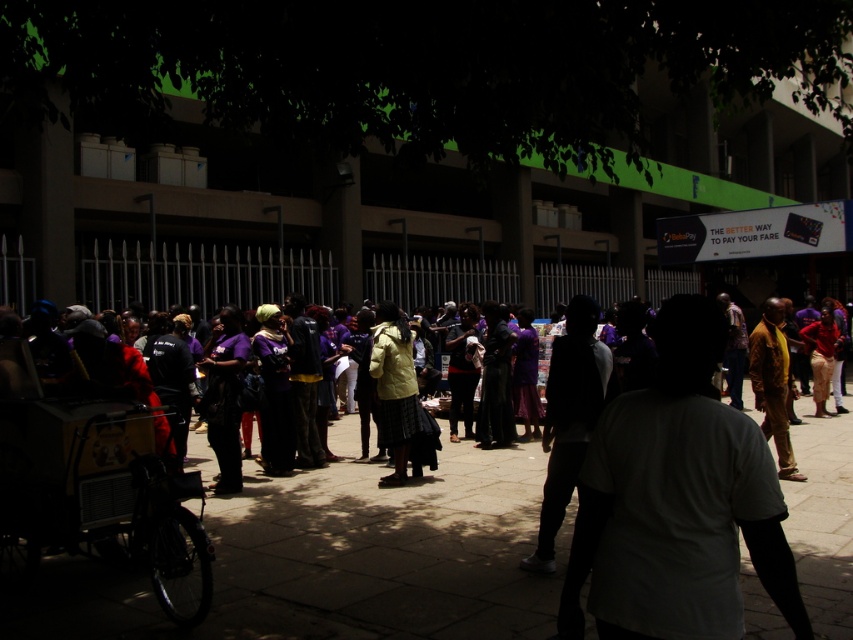
Between white matte shirt at center and dark fabric pants at center, which one is positioned lower?

Positioned lower is white matte shirt at center.

Is white matte shirt at center taller than dark fabric pants at center?

In fact, white matte shirt at center may be shorter than dark fabric pants at center.

Where is `white matte shirt at center`? The image size is (853, 640). white matte shirt at center is located at coordinates (677, 500).

At what (x,y) coordinates should I click in order to perform the action: click on white matte shirt at center. Please return your answer as a coordinate pair (x, y). This screenshot has height=640, width=853. Looking at the image, I should click on (677, 500).

Measure the distance between purple fabric at center and camera.

They are 4.25 meters apart.

Image resolution: width=853 pixels, height=640 pixels. I want to click on purple fabric at center, so click(x=338, y=557).

I want to click on purple fabric at center, so click(x=338, y=557).

Is point (729, 580) farther from camera compared to point (779, 340)?

No.

Describe the element at coordinates (677, 500) in the screenshot. I see `white matte shirt at center` at that location.

Does point (618, 506) come closer to viewer compared to point (761, 428)?

Yes.

The height and width of the screenshot is (640, 853). What are the coordinates of `white matte shirt at center` in the screenshot? It's located at (677, 500).